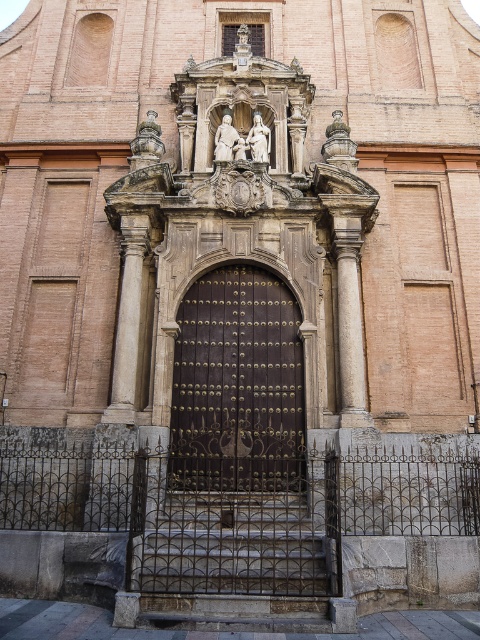
Can you confirm if matte stone statue at center is wider than white marble statue at center?

Yes, matte stone statue at center is wider than white marble statue at center.

Does point (262, 132) lie behind point (230, 112)?

That is False.

At what (x,y) coordinates should I click in order to perform the action: click on matte stone statue at center. Please return your answer as a coordinate pair (x, y). The image size is (480, 640). Looking at the image, I should click on (259, 140).

Which of these two, dark brown wrought iron gate at center or matte stone statue at center, stands taller?

With more height is dark brown wrought iron gate at center.

Can you confirm if dark brown wrought iron gate at center is wider than matte stone statue at center?

Indeed, dark brown wrought iron gate at center has a greater width compared to matte stone statue at center.

Locate an element on the screen. dark brown wrought iron gate at center is located at coordinates (238, 385).

Does dark brown wrought iron gate at center come behind white marble statue at center?

No, dark brown wrought iron gate at center is in front of white marble statue at center.

You are a GUI agent. You are given a task and a screenshot of the screen. Output one action in this format:
    pyautogui.click(x=<x>, y=<y>)
    Task: Click on the dark brown wrought iron gate at center
    The width and height of the screenshot is (480, 640).
    Given the screenshot: What is the action you would take?
    pyautogui.click(x=238, y=385)

Is point (239, 474) farther from viewer compared to point (231, 156)?

No, (239, 474) is in front of (231, 156).

The image size is (480, 640). What are the coordinates of `dark brown wrought iron gate at center` in the screenshot? It's located at (238, 385).